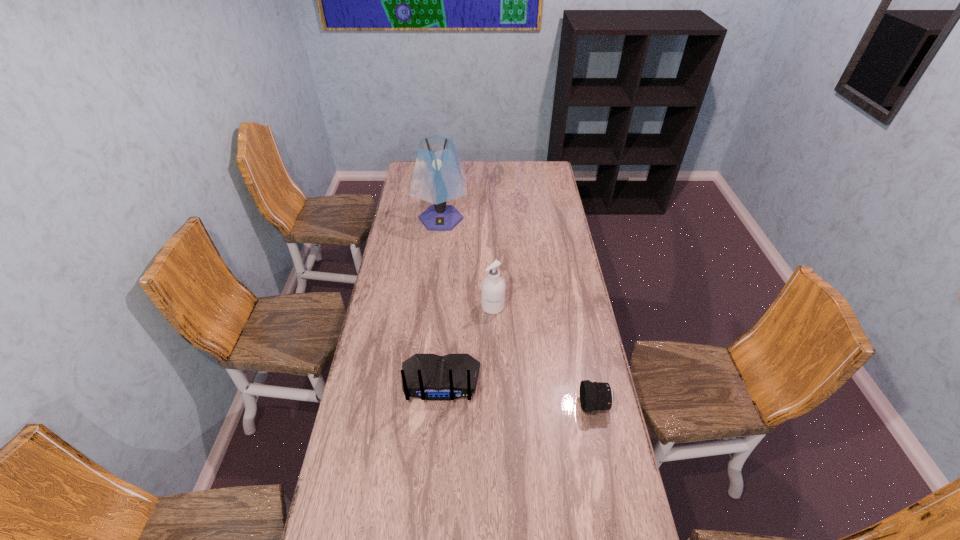
The width and height of the screenshot is (960, 540). I want to click on the tallest object, so click(438, 176).

I want to click on the farthest object, so coord(438,176).

Where is `the third object from left to right`? Image resolution: width=960 pixels, height=540 pixels. the third object from left to right is located at coordinates (493, 287).

Identify the location of the second tallest object. (493, 287).

Identify the location of router. (431, 377).

Where is `the rightmost object`? Image resolution: width=960 pixels, height=540 pixels. the rightmost object is located at coordinates (594, 396).

I want to click on the shortest object, so click(x=594, y=396).

At what (x,y) coordinates should I click in order to perform the action: click on vacant area situated on the base of the lampshade. Please return your answer as a coordinate pair (x, y). Looking at the image, I should click on [x=433, y=296].

Image resolution: width=960 pixels, height=540 pixels. What are the coordinates of `free space located 0.210m on the front label of the third shortest object` in the screenshot? It's located at (494, 358).

Find the location of a particular element. free region located on the back of the router is located at coordinates (432, 501).